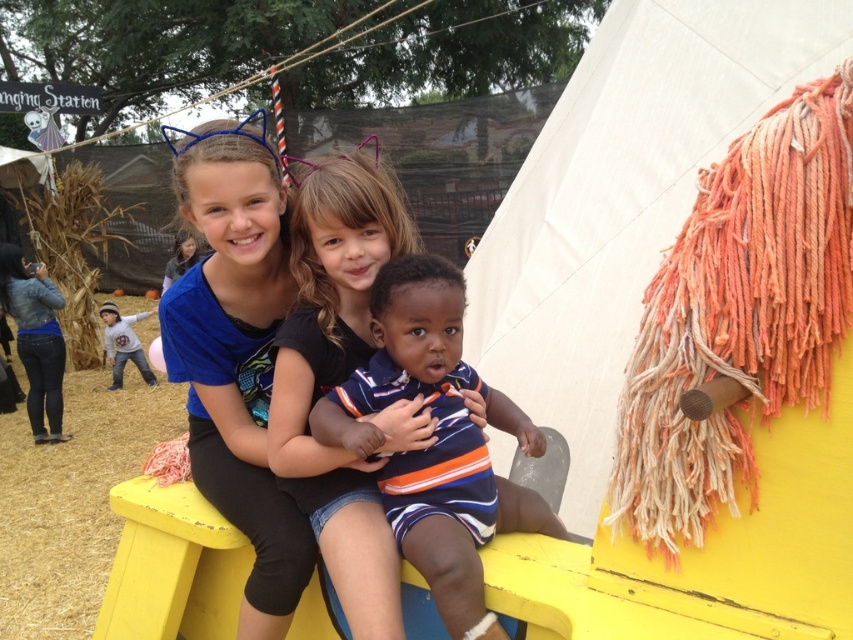
Is the position of blue fabric headband at upper center more distant than that of striped cotton shirt at center?

Yes, it is.

Is blue fabric headband at upper center to the right of striped cotton shirt at center from the viewer's perspective?

In fact, blue fabric headband at upper center is to the left of striped cotton shirt at center.

Which is behind, point (183, 160) or point (482, 500)?

Point (183, 160)

Locate an element on the screen. This screenshot has width=853, height=640. blue fabric headband at upper center is located at coordinates (236, 353).

Does matte black shirt at center have a greater width compared to striped cotton shirt at center?

No.

Is point (341, 305) in front of point (476, 589)?

That is False.

Locate an element on the screen. Image resolution: width=853 pixels, height=640 pixels. matte black shirt at center is located at coordinates (337, 378).

Between point (190, 445) and point (291, 394), which one is positioned in front?

Point (291, 394) is more forward.

What do you see at coordinates (236, 353) in the screenshot?
I see `blue fabric headband at upper center` at bounding box center [236, 353].

Is point (199, 230) positioned behind point (296, 211)?

Yes, point (199, 230) is behind point (296, 211).

Where is `blue fabric headband at upper center`? The image size is (853, 640). blue fabric headband at upper center is located at coordinates (236, 353).